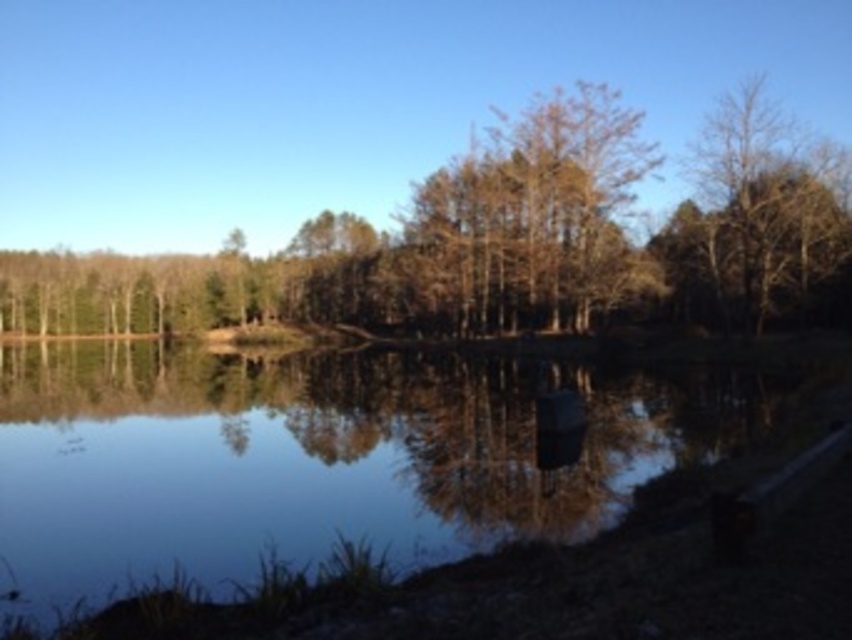
Who is positioned more to the left, smooth reflective water at center or brown leafy tree at center?

From the viewer's perspective, brown leafy tree at center appears more on the left side.

Can you confirm if smooth reflective water at center is bigger than brown leafy tree at center?

Incorrect, smooth reflective water at center is not larger than brown leafy tree at center.

Is point (99, 419) behind point (445, 269)?

No, it is in front of (445, 269).

Where is `smooth reflective water at center`? The width and height of the screenshot is (852, 640). smooth reflective water at center is located at coordinates (376, 483).